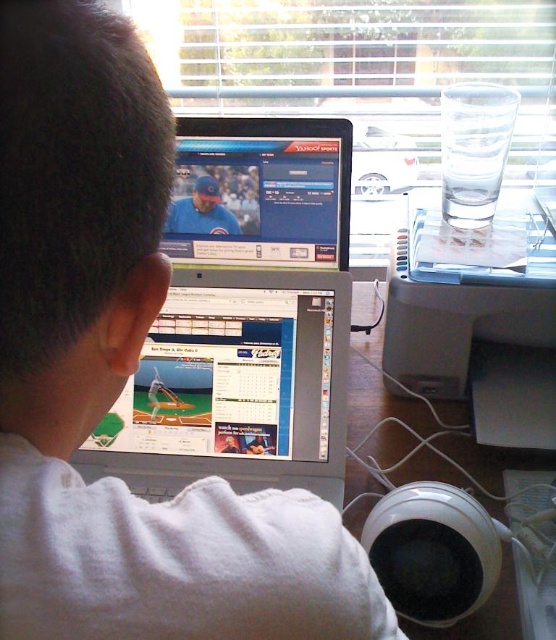
You are organizing the desk items and need to place a new item between the silver metallic laptop at center and the transparent plastic printer at upper right. Based on their heights, which object should be placed lower to ensure stability?

The transparent plastic printer at upper right should be placed lower because it is shorter than the silver metallic laptop at center, allowing for a stable arrangement.

Where is the silver metallic laptop at center located in the image?

The silver metallic laptop at center is located at point 0.495 in the x coordinate and 0.441 in the y coordinate.